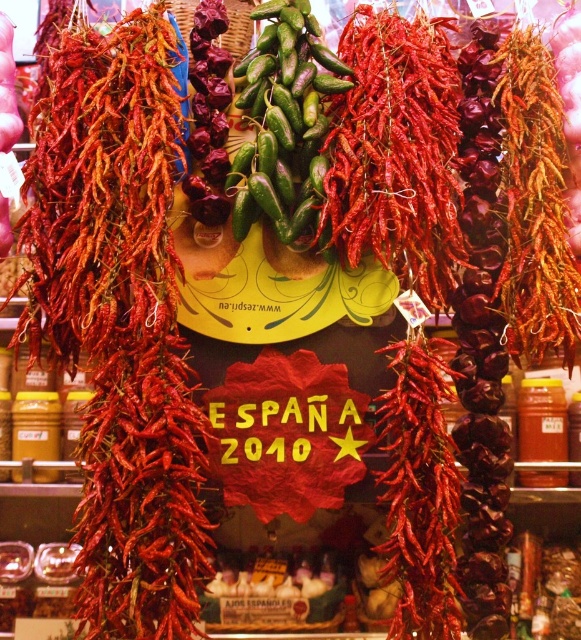
Question: Is dried red pepper at center positioned at the back of green glossy jalapeños at center?

Choices:
 (A) no
 (B) yes

Answer: (A)

Question: Among these points, which one is nearest to the camera?

Choices:
 (A) (66, 282)
 (B) (328, 84)

Answer: (A)

Question: Is dried red pepper at center below green glossy jalapeños at center?

Choices:
 (A) yes
 (B) no

Answer: (A)

Question: In this image, where is dried red pepper at center located relative to green glossy jalapeños at center?

Choices:
 (A) above
 (B) below

Answer: (B)

Question: Which point is farther from the camera taking this photo?

Choices:
 (A) (306, 180)
 (B) (138, 326)

Answer: (A)

Question: Which point is closer to the camera taking this photo?

Choices:
 (A) (66, 243)
 (B) (340, 90)

Answer: (A)